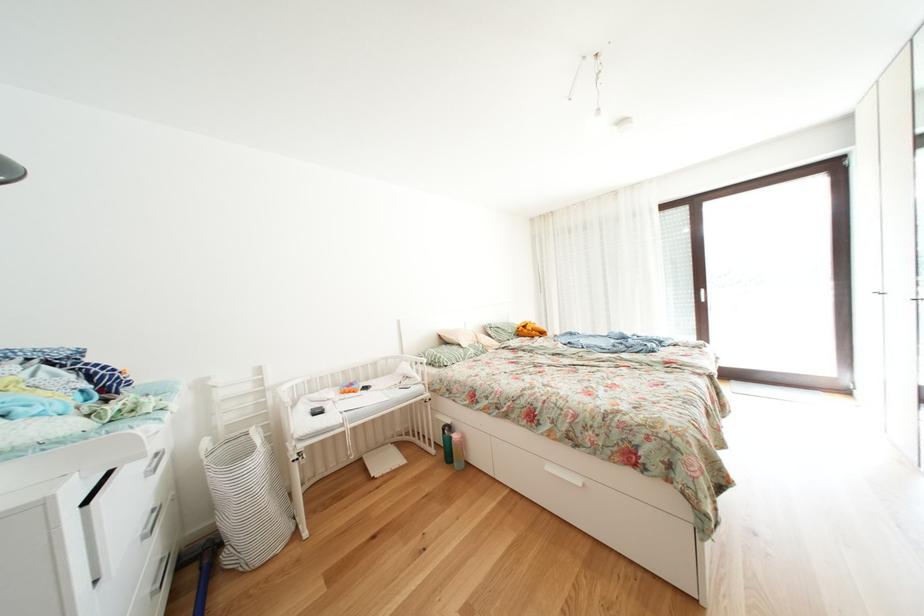
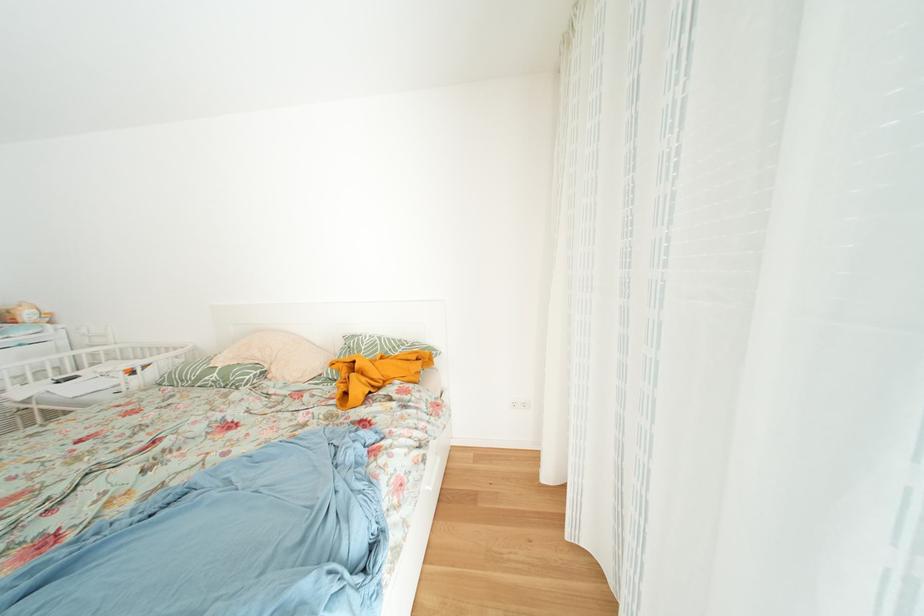
In the second image, find the point that corresponds to pixel 475 360 in the first image.

(208, 384)